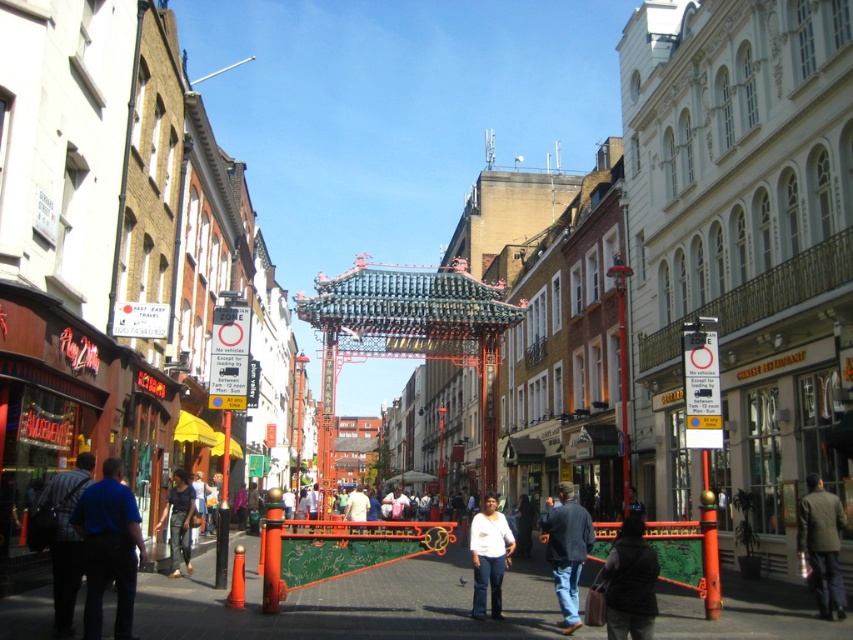
Question: Which of these objects is positioned farthest from the denim jacket at center?

Choices:
 (A) dark gray fabric jacket at center
 (B) white matte shirt at center

Answer: (A)

Question: Considering the real-world distances, which object is closest to the dark brown jacket at lower right?

Choices:
 (A) white matte shirt at center
 (B) dark blue shirt at center
 (C) denim jacket at center

Answer: (C)

Question: Which object appears farthest from the camera in this image?

Choices:
 (A) white matte shirt at center
 (B) dark gray fabric jacket at center

Answer: (A)

Question: Is dark blue shirt at lower left to the left of dark blue shirt at center from the viewer's perspective?

Choices:
 (A) no
 (B) yes

Answer: (B)

Question: Can you confirm if blue shirt at lower left is positioned to the left of dark blue shirt at center?

Choices:
 (A) no
 (B) yes

Answer: (A)

Question: Is dark brown jacket at lower right thinner than dark blue shirt at center?

Choices:
 (A) yes
 (B) no

Answer: (A)